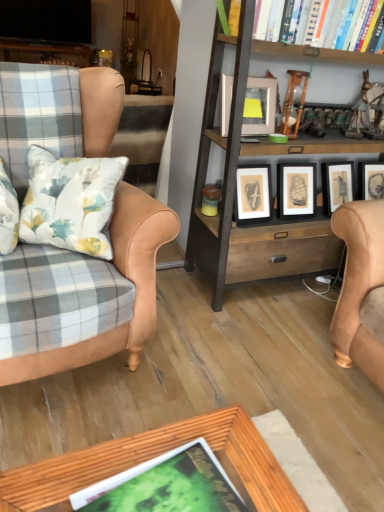
Measure the distance between point (275, 153) and camera.

The depth of point (275, 153) is 5.89 feet.

Locate an element on the screen. The height and width of the screenshot is (512, 384). wooden bookcase at center is located at coordinates (235, 185).

Describe the element at coordinates (259, 106) in the screenshot. Image resolution: width=384 pixels, height=512 pixels. I see `matte silver picture frame at upper center` at that location.

Locate an element on the screen. matte silver picture frame at upper center is located at coordinates (259, 106).

This screenshot has height=512, width=384. Describe the element at coordinates (166, 485) in the screenshot. I see `green matte book at lower center, which ranks as the first book in bottom-to-top order` at that location.

Locate an element on the screen. Image resolution: width=384 pixels, height=512 pixels. wooden bookcase at center is located at coordinates (235, 185).

How different are the orientations of leather armchair at left and matte silver picture frame at upper center in degrees?

The facing directions of leather armchair at left and matte silver picture frame at upper center are 9 degrees apart.

In the scene shown: From the image's perspective, which one is positioned lower, leather armchair at left or matte silver picture frame at upper center?

leather armchair at left, from the image's perspective.

Is leather armchair at left facing away from matte silver picture frame at upper center?

No, leather armchair at left is not facing away from matte silver picture frame at upper center.

Does leather armchair at left appear on the left side of matte silver picture frame at upper center?

Correct, you'll find leather armchair at left to the left of matte silver picture frame at upper center.

From the image's perspective, which object appears higher, wooden bookcase at center or green matte book at lower center, placed as the 2th book when sorted from right to left?

wooden bookcase at center.

Between point (208, 98) and point (205, 450), which one is positioned behind?

The point (208, 98) is farther.

Which of these two, wooden bookcase at center or green matte book at lower center, acting as the second book starting from the back, stands shorter?

green matte book at lower center, acting as the second book starting from the back, is shorter.

Does matte silver picture frame at upper center lie behind hardcover book at upper right, acting as the second book starting from the front?

Yes, it is.

Is matte silver picture frame at upper center positioned beyond the bounds of hardcover book at upper right, placed as the 1th book when sorted from back to front?

matte silver picture frame at upper center is positioned outside hardcover book at upper right, placed as the 1th book when sorted from back to front.

Locate an element on the screen. The image size is (384, 512). book above the matte silver picture frame at upper center (from the image's perspective) is located at coordinates (323, 37).

Can you confirm if hardcover book at upper right, the 1th book viewed from the top, is thinner than wooden bookcase at center?

Yes.

From the image's perspective, who appears lower, hardcover book at upper right, acting as the second book starting from the front, or wooden bookcase at center?

wooden bookcase at center appears lower in the image.

Is hardcover book at upper right, acting as the second book starting from the front, spatially inside wooden bookcase at center, or outside of it?

hardcover book at upper right, acting as the second book starting from the front, is contained in wooden bookcase at center.

Between hardcover book at upper right, which is the 1th book from right to left, and green matte book at lower center, placed as the 1th book when sorted from left to right, which one appears on the left side from the viewer's perspective?

Positioned to the left is green matte book at lower center, placed as the 1th book when sorted from left to right.

From the image's perspective, which one is positioned lower, hardcover book at upper right, placed as the 1th book when sorted from back to front, or green matte book at lower center, which ranks as the first book in bottom-to-top order?

green matte book at lower center, which ranks as the first book in bottom-to-top order.

Does hardcover book at upper right, the 1th book viewed from the top, have a greater height compared to green matte book at lower center, marked as the 1th book in a front-to-back arrangement?

Yes.

Considering the positions of point (356, 21) and point (158, 459), is point (356, 21) closer or farther from the camera than point (158, 459)?

Point (356, 21) is farther from the camera than point (158, 459).

Is hardcover book at upper right, placed as the second book when sorted from bottom to top, shorter than leather armchair at left?

Indeed, hardcover book at upper right, placed as the second book when sorted from bottom to top, has a lesser height compared to leather armchair at left.

Between hardcover book at upper right, the 1th book viewed from the top, and leather armchair at left, which one has smaller width?

With smaller width is hardcover book at upper right, the 1th book viewed from the top.

Is hardcover book at upper right, acting as the second book starting from the front, aimed at leather armchair at left?

No, hardcover book at upper right, acting as the second book starting from the front, is not facing towards leather armchair at left.

Are hardcover book at upper right, the 1th book viewed from the top, and leather armchair at left making contact?

No, hardcover book at upper right, the 1th book viewed from the top, is not beside leather armchair at left.

Identify the location of book beneath the leather armchair at left (from a real-world perspective). point(166,485).

Visually, is green matte book at lower center, placed as the 1th book when sorted from left to right, positioned to the left or to the right of leather armchair at left?

From the image, it's evident that green matte book at lower center, placed as the 1th book when sorted from left to right, is to the right of leather armchair at left.

Can you tell me how much green matte book at lower center, acting as the second book starting from the back, and leather armchair at left differ in facing direction?

green matte book at lower center, acting as the second book starting from the back, and leather armchair at left are facing 77.3 degrees away from each other.

Can we say green matte book at lower center, which ranks as the first book in bottom-to-top order, lies outside leather armchair at left?

Absolutely, green matte book at lower center, which ranks as the first book in bottom-to-top order, is external to leather armchair at left.

Where is `chair below the matte silver picture frame at upper center (from a real-world perspective)`? chair below the matte silver picture frame at upper center (from a real-world perspective) is located at coordinates (123, 275).

You are a GUI agent. You are given a task and a screenshot of the screen. Output one action in this format:
    pyautogui.click(x=<x>, y=<y>)
    Task: Click on the bookcase above the green matte book at lower center, placed as the 2th book when sorted from right to left (from the image's perspective)
    The width and height of the screenshot is (384, 512).
    Given the screenshot: What is the action you would take?
    pyautogui.click(x=235, y=185)

Looking at this image, looking at the image, which one is located closer to matte silver picture frame at upper center, green matte book at lower center, which ranks as the 2th book in top-to-bottom order, or wooden bookcase at center?

wooden bookcase at center lies closer to matte silver picture frame at upper center than the other object.

Which object lies nearer to the anchor point wooden bookcase at center, leather armchair at left or hardcover book at upper right, acting as the second book starting from the front?

hardcover book at upper right, acting as the second book starting from the front.

Looking at the image, which one is located closer to green matte book at lower center, marked as the 1th book in a front-to-back arrangement, leather armchair at left or hardcover book at upper right, acting as the second book starting from the front?

leather armchair at left.

Considering their positions, is hardcover book at upper right, which is the 1th book from right to left, positioned closer to wooden bookcase at center than leather armchair at left?

Among the two, hardcover book at upper right, which is the 1th book from right to left, is located nearer to wooden bookcase at center.

Estimate the real-world distances between objects in this image. Which object is further from green matte book at lower center, acting as the second book starting from the back, wooden bookcase at center or leather armchair at left?

wooden bookcase at center is positioned further to the anchor green matte book at lower center, acting as the second book starting from the back.

From the image, which object appears to be nearer to hardcover book at upper right, placed as the second book when sorted from bottom to top, leather armchair at left or wooden bookcase at center?

wooden bookcase at center lies closer to hardcover book at upper right, placed as the second book when sorted from bottom to top, than the other object.

Considering their positions, is wooden bookcase at center positioned further to matte silver picture frame at upper center than leather armchair at left?

The object further to matte silver picture frame at upper center is leather armchair at left.

From the image, which object appears to be farther from green matte book at lower center, marked as the 1th book in a front-to-back arrangement, leather armchair at left or wooden bookcase at center?

The object further to green matte book at lower center, marked as the 1th book in a front-to-back arrangement, is wooden bookcase at center.

I want to click on picture frame situated between leather armchair at left and hardcover book at upper right, placed as the second book when sorted from bottom to top, from left to right, so click(259, 106).

Image resolution: width=384 pixels, height=512 pixels. I want to click on book between leather armchair at left and wooden bookcase at center in the horizontal direction, so click(x=166, y=485).

This screenshot has width=384, height=512. What are the coordinates of `chair positioned between green matte book at lower center, which ranks as the first book in bottom-to-top order, and matte silver picture frame at upper center from near to far` in the screenshot? It's located at (123, 275).

Where is `picture frame between hardcover book at upper right, which is the 1th book from right to left, and green matte book at lower center, acting as the second book starting from the back, in the up-down direction`? picture frame between hardcover book at upper right, which is the 1th book from right to left, and green matte book at lower center, acting as the second book starting from the back, in the up-down direction is located at coordinates (259, 106).